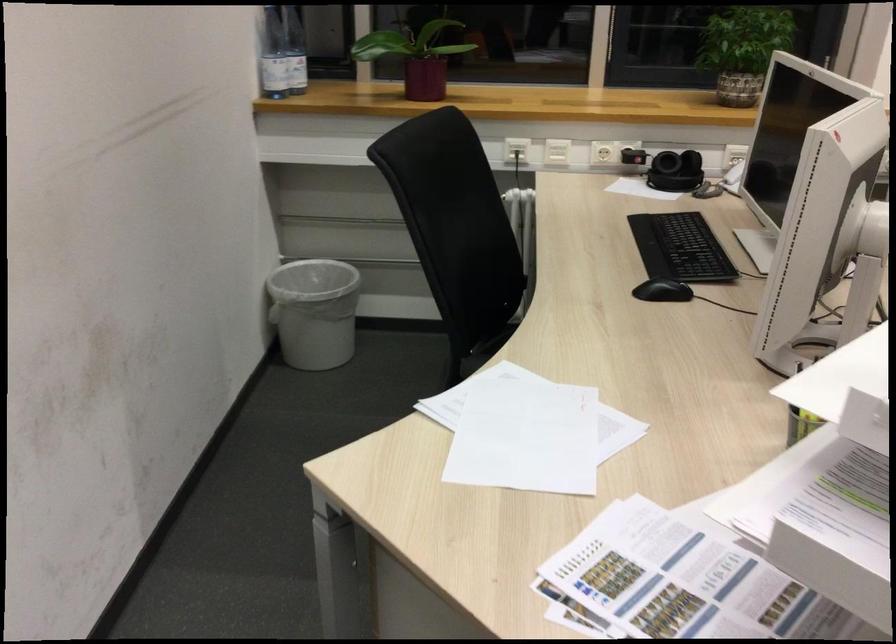
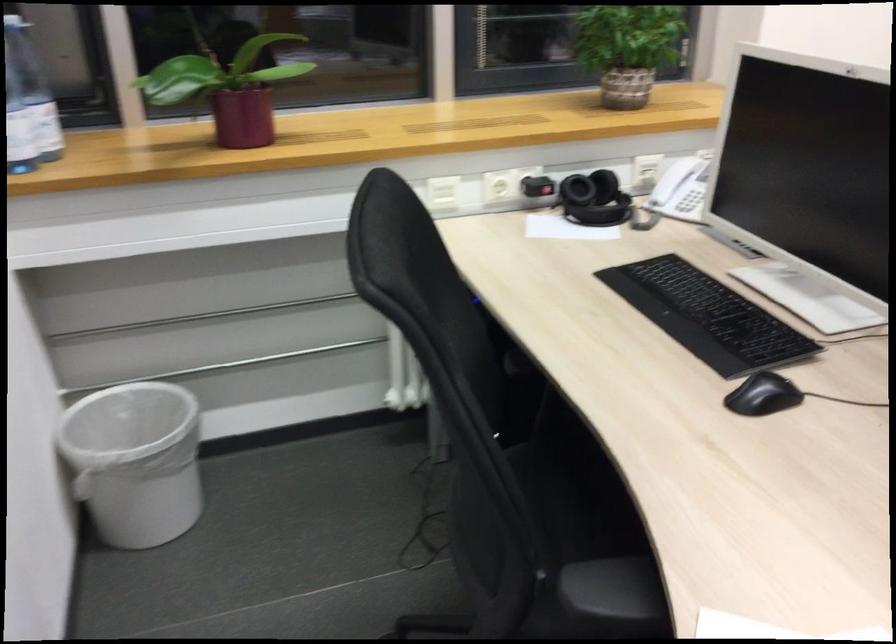
Question: The camera is either moving clockwise (left) or counter-clockwise (right) around the object. The first image is from the beginning of the video and the second image is from the end. Is the camera moving left or right when shooting the video?

Choices:
 (A) Left
 (B) Right

Answer: (A)